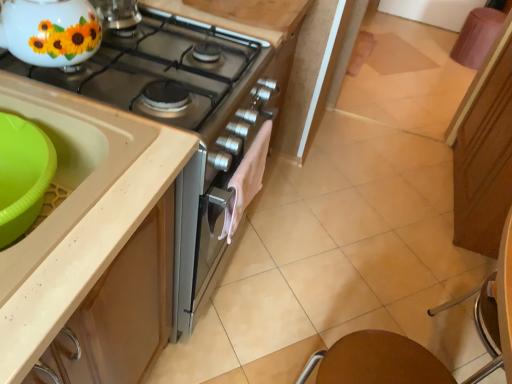
The image size is (512, 384). I want to click on free space above brown matte table at lower right (from a real-world perspective), so click(391, 360).